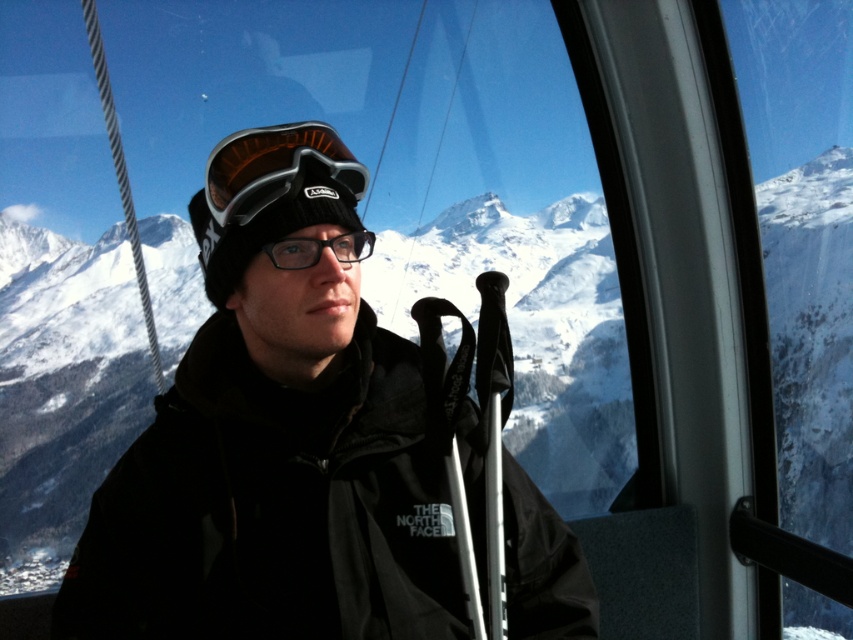
Question: Can you confirm if black matte jacket at center is smaller than matte black goggles at center?

Choices:
 (A) yes
 (B) no

Answer: (B)

Question: Among these objects, which one is farthest from the camera?

Choices:
 (A) black matte jacket at center
 (B) matte black goggles at center

Answer: (B)

Question: Is black matte jacket at center to the right of matte black goggles at center from the viewer's perspective?

Choices:
 (A) no
 (B) yes

Answer: (B)

Question: Is black matte jacket at center bigger than matte black goggles at center?

Choices:
 (A) no
 (B) yes

Answer: (B)